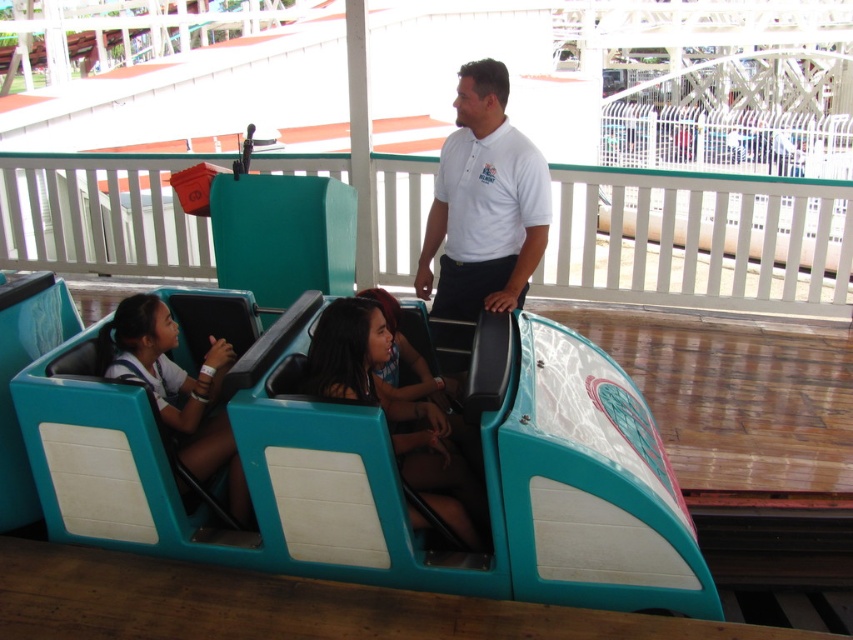
Question: Is matte teal seat at center in front of white matte shirt at center?

Choices:
 (A) no
 (B) yes

Answer: (B)

Question: Is white cotton shirt at center thinner than white matte shirt at center?

Choices:
 (A) yes
 (B) no

Answer: (B)

Question: Among these points, which one is farthest from the camera?

Choices:
 (A) (469, 84)
 (B) (173, 332)

Answer: (A)

Question: Considering the relative positions of white cotton shirt at center and matte teal seat at center in the image provided, where is white cotton shirt at center located with respect to matte teal seat at center?

Choices:
 (A) below
 (B) above

Answer: (B)

Question: Based on their relative distances, which object is nearer to the matte teal seat at center?

Choices:
 (A) white cotton shirt at center
 (B) white matte shirt at center

Answer: (B)

Question: Which is farther from the white matte shirt at center?

Choices:
 (A) white cotton shirt at center
 (B) matte teal seat at center

Answer: (A)